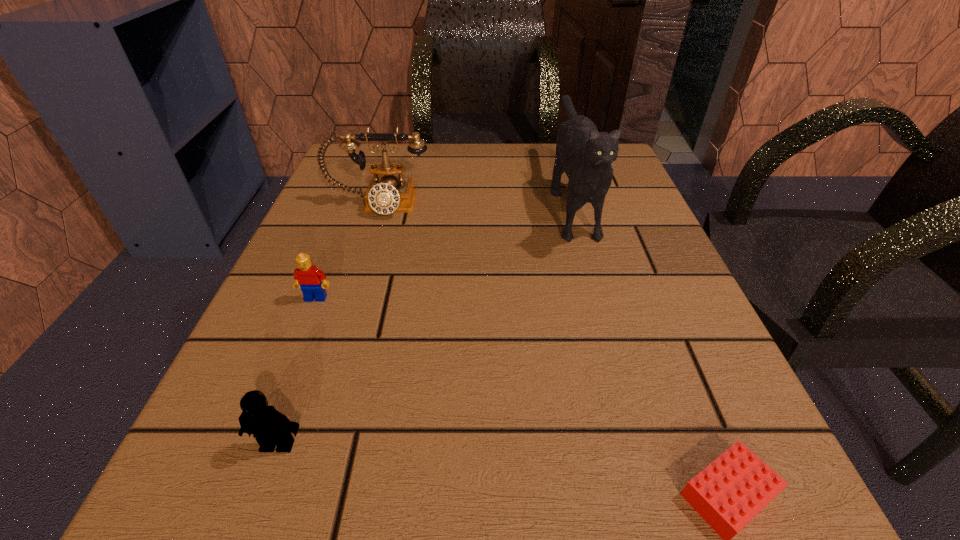
What are the coordinates of `object present at the right edge` in the screenshot? It's located at (585, 155).

You are a GUI agent. You are given a task and a screenshot of the screen. Output one action in this format:
    pyautogui.click(x=<x>, y=<y>)
    Task: Click on the object located at the far left corner
    Image resolution: width=960 pixels, height=540 pixels.
    Given the screenshot: What is the action you would take?
    pyautogui.click(x=389, y=194)

Where is `object that is at the near left corner`? The image size is (960, 540). object that is at the near left corner is located at coordinates (271, 428).

This screenshot has height=540, width=960. Find the location of `object located in the far right corner section of the desktop`. object located in the far right corner section of the desktop is located at coordinates (585, 155).

In the image, there is a desktop. Where is `vacant region at the far edge`? vacant region at the far edge is located at coordinates (442, 190).

At what (x,y) coordinates should I click in order to perform the action: click on vacant space at the near edge. Please return your answer as a coordinate pair (x, y). Image resolution: width=960 pixels, height=540 pixels. Looking at the image, I should click on (440, 467).

This screenshot has height=540, width=960. In the image, there is a desktop. What are the coordinates of `vacant space at the left edge` in the screenshot? It's located at (235, 395).

The image size is (960, 540). I want to click on free spot at the right edge of the desktop, so click(631, 237).

Identify the location of vacant space at the far left corner of the desktop. (403, 160).

Locate an element on the screen. The width and height of the screenshot is (960, 540). free space at the near right corner is located at coordinates (701, 522).